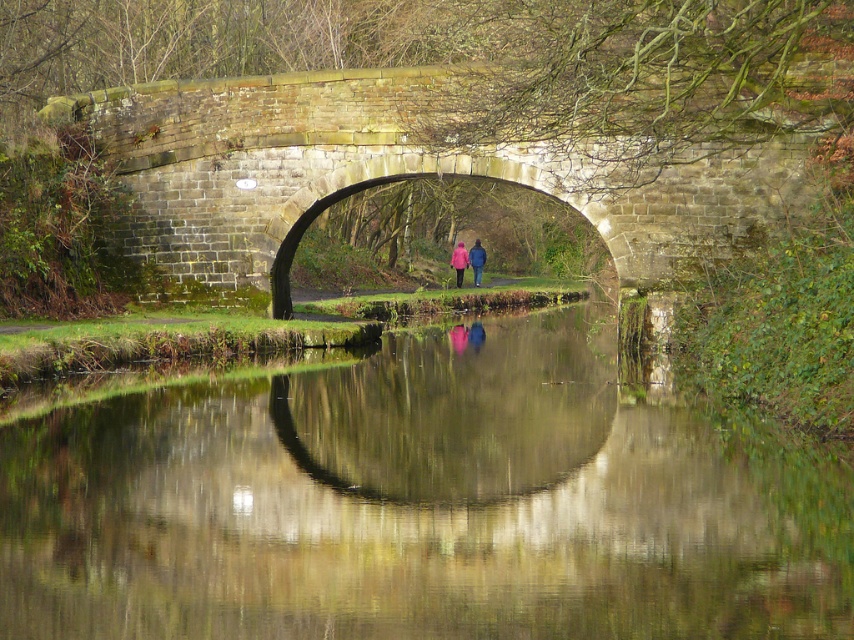
Is point (800, 173) in front of point (457, 268)?

Yes.

Is stone bridge at center shorter than matte pink coat at center?

In fact, stone bridge at center may be taller than matte pink coat at center.

Does point (227, 209) come closer to viewer compared to point (483, 262)?

That is True.

Identify the location of stone bridge at center. [x=402, y=172].

Between smooth reflective water at center and pink fabric at center, which one has less height?

Standing shorter between the two is smooth reflective water at center.

Can you confirm if smooth reflective water at center is positioned to the right of pink fabric at center?

In fact, smooth reflective water at center is to the left of pink fabric at center.

What do you see at coordinates (414, 500) in the screenshot?
I see `smooth reflective water at center` at bounding box center [414, 500].

Identify the location of smooth reflective water at center. (414, 500).

Does smooth reflective water at center come behind blue fabric jacket at center?

No, it is not.

Is smooth reflective water at center thinner than blue fabric jacket at center?

Incorrect, smooth reflective water at center's width is not less than blue fabric jacket at center's.

Which is behind, point (241, 509) or point (478, 257)?

Positioned behind is point (478, 257).

The width and height of the screenshot is (854, 640). In order to click on smooth reflective water at center in this screenshot , I will do `click(414, 500)`.